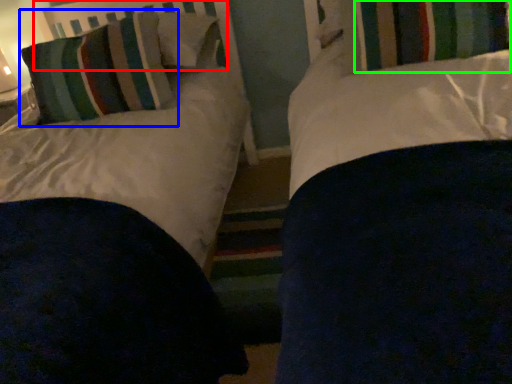
Question: Which is nearer to the headboard (highlighted by a red box)? pillow (highlighted by a blue box) or curtain (highlighted by a green box).

Choices:
 (A) pillow
 (B) curtain

Answer: (A)